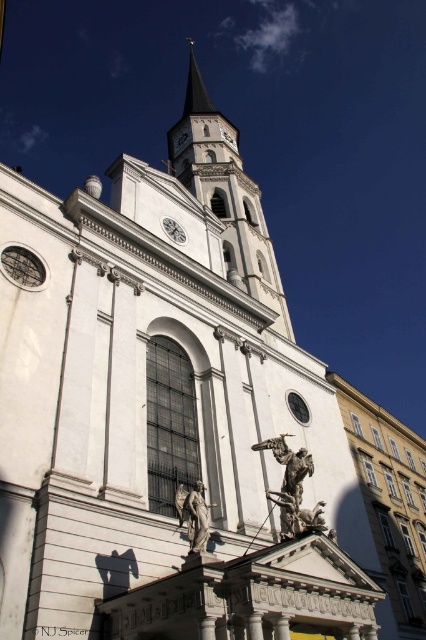
Question: Is white stone clock tower at upper center bigger than polished bronze statue at lower center?

Choices:
 (A) yes
 (B) no

Answer: (A)

Question: Which point is farther from the camera taking this photo?

Choices:
 (A) (296, 515)
 (B) (203, 516)

Answer: (A)

Question: Which of the following is the farthest from the observer?

Choices:
 (A) (184, 134)
 (B) (181, 490)
 (C) (279, 493)

Answer: (A)

Question: Which of the following is the farthest from the observer?

Choices:
 (A) white stone clock tower at upper center
 (B) bronze statue at center

Answer: (A)

Question: Is bronze statue at center smaller than polished bronze statue at lower center?

Choices:
 (A) yes
 (B) no

Answer: (B)

Question: Is white stone clock tower at upper center smaller than bronze statue at center?

Choices:
 (A) no
 (B) yes

Answer: (A)